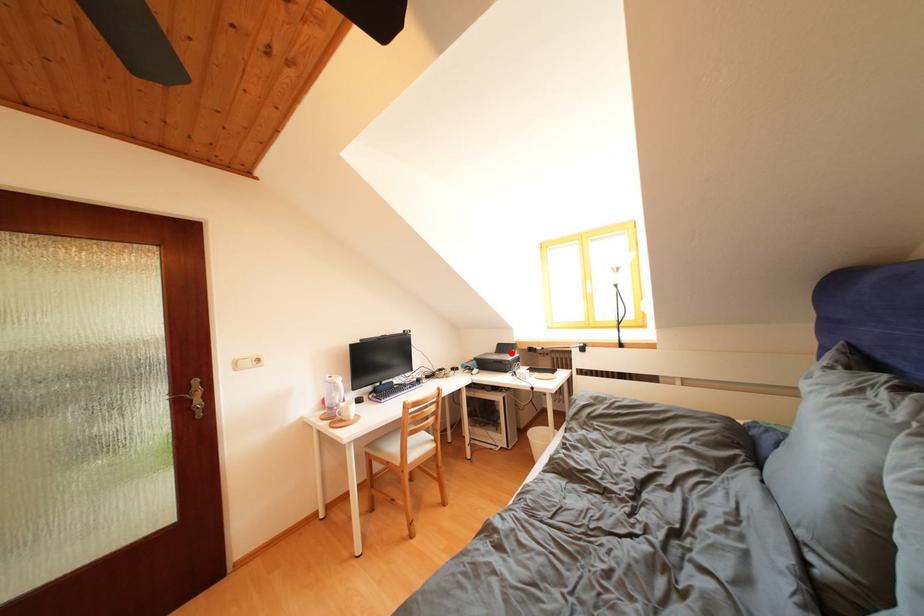
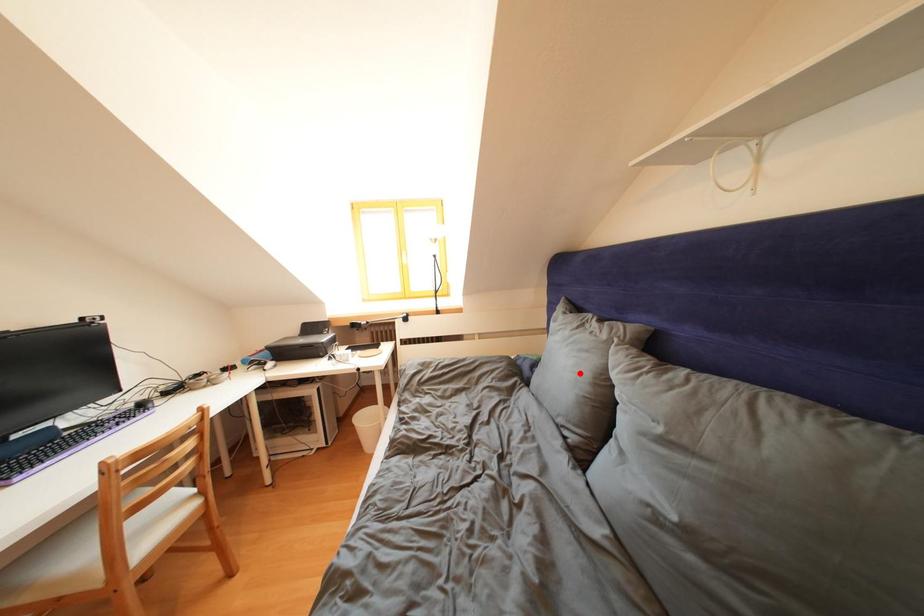
I am providing you with two images of the same scene from different viewpoints. A red point is marked on the first image and another point is marked on the second image. Do the highlighted points in image1 and image2 indicate the same real-world spot?

No